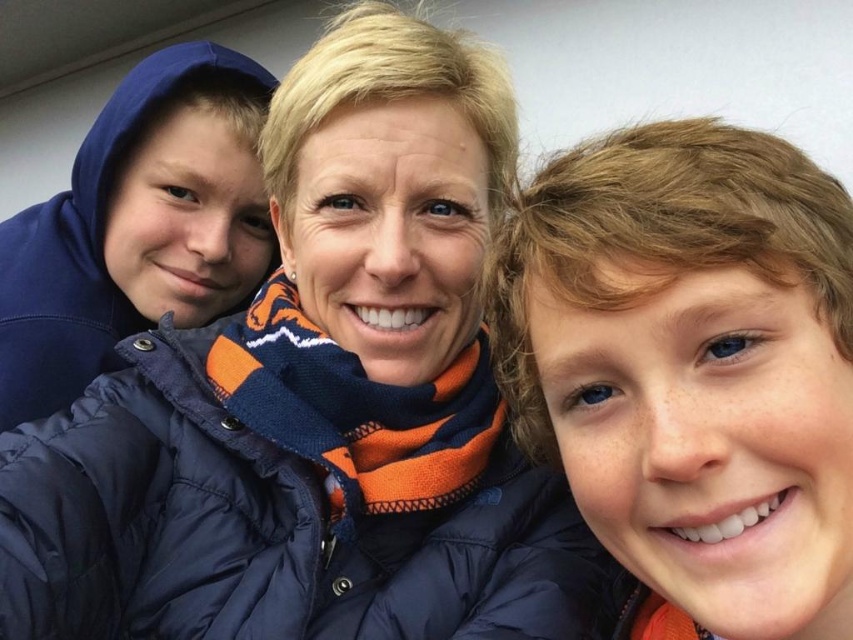
Which is below, brown curly hair at upper right or blue fleece hoodie at left?

Positioned lower is brown curly hair at upper right.

Is brown curly hair at upper right taller than blue fleece hoodie at left?

No.

Who is more distant from viewer, (x=810, y=196) or (x=212, y=83)?

Positioned behind is point (x=212, y=83).

Where is `brown curly hair at upper right`? The image size is (853, 640). brown curly hair at upper right is located at coordinates (691, 371).

Is point (242, 561) closer to viewer compared to point (76, 369)?

Yes, it is in front of point (76, 369).

Between navy blue puffer jacket at center and blue fleece hoodie at left, which one has less height?

blue fleece hoodie at left is shorter.

Which is behind, point (399, 259) or point (244, 92)?

The point (244, 92) is behind.

This screenshot has width=853, height=640. In order to click on navy blue puffer jacket at center in this screenshot , I will do `click(318, 403)`.

Who is shorter, navy blue puffer jacket at center or brown curly hair at upper right?

With less height is brown curly hair at upper right.

Is navy blue puffer jacket at center closer to camera compared to brown curly hair at upper right?

No, navy blue puffer jacket at center is further to the viewer.

Where is `navy blue puffer jacket at center`? This screenshot has height=640, width=853. navy blue puffer jacket at center is located at coordinates (318, 403).